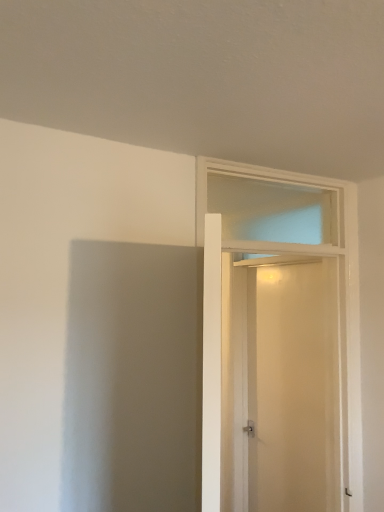
Question: In terms of width, does white glossy door at center look wider or thinner when compared to beige matte screen door at center?

Choices:
 (A) wide
 (B) thin

Answer: (A)

Question: From a real-world perspective, is white glossy door at center above or below beige matte screen door at center?

Choices:
 (A) below
 (B) above

Answer: (B)

Question: Is point (278, 473) closer or farther from the camera than point (314, 474)?

Choices:
 (A) farther
 (B) closer

Answer: (A)

Question: Is beige matte screen door at center wider or thinner than white glossy door at center?

Choices:
 (A) thin
 (B) wide

Answer: (A)

Question: Considering the relative positions of beige matte screen door at center and white glossy door at center in the image provided, is beige matte screen door at center to the left or to the right of white glossy door at center?

Choices:
 (A) left
 (B) right

Answer: (B)

Question: From a real-world perspective, is beige matte screen door at center positioned above or below white glossy door at center?

Choices:
 (A) below
 (B) above

Answer: (A)

Question: Considering the positions of beige matte screen door at center and white glossy door at center in the image, is beige matte screen door at center taller or shorter than white glossy door at center?

Choices:
 (A) tall
 (B) short

Answer: (A)